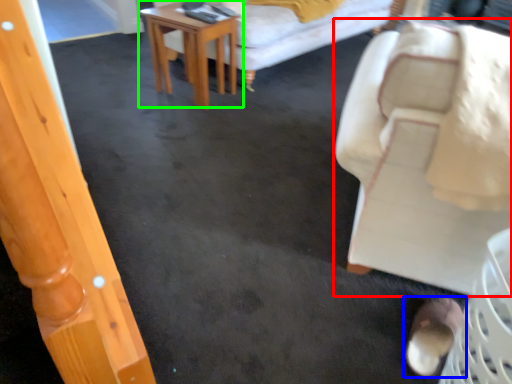
Question: Which object is the closest to the chair (highlighted by a red box)? Choose among these: footwear (highlighted by a blue box) or table (highlighted by a green box).

Choices:
 (A) footwear
 (B) table

Answer: (A)